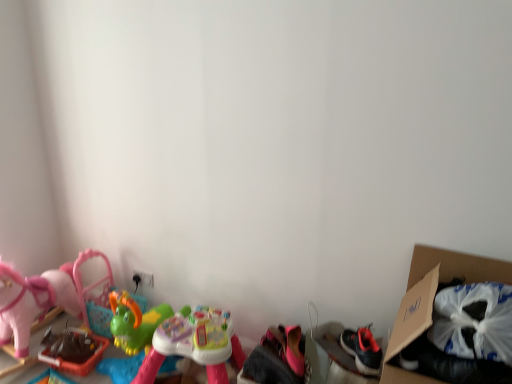
Question: Considering the positions of cardboard box at right and rubberized green toy at lower left, which appears as the third toy when viewed from the right, in the image, is cardboard box at right taller or shorter than rubberized green toy at lower left, which appears as the third toy when viewed from the right,?

Choices:
 (A) short
 (B) tall

Answer: (B)

Question: Considering their positions, is cardboard box at right located in front of or behind rubberized green toy at lower left, the first toy positioned from the left?

Choices:
 (A) behind
 (B) front

Answer: (B)

Question: Based on their relative distances, which object is nearer to the cardboard box at right?

Choices:
 (A) rubberized green toy at lower left, the first toy positioned from the left
 (B) multicolored plastic toy at center, the 2th toy when ordered from left to right
 (C) pink fabric shoes at lower center, acting as the 1th toy starting from the right

Answer: (C)

Question: Estimate the real-world distances between objects in this image. Which object is farther from the pink fabric shoes at lower center, acting as the 1th toy starting from the right?

Choices:
 (A) rubberized green toy at lower left, which appears as the third toy when viewed from the right
 (B) multicolored plastic toy at center, the 2th toy when ordered from left to right
 (C) cardboard box at right

Answer: (A)